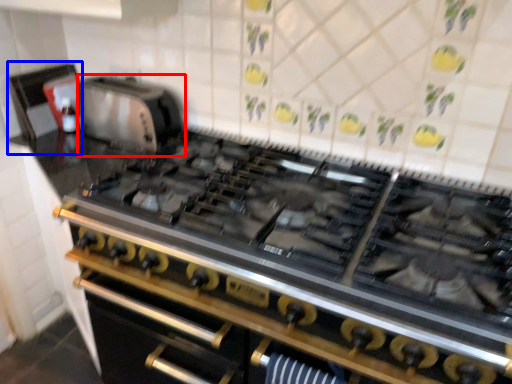
Question: Which point is closer to the camera, appliance (highlighted by a red box) or appliance (highlighted by a blue box)?

Choices:
 (A) appliance
 (B) appliance

Answer: (A)